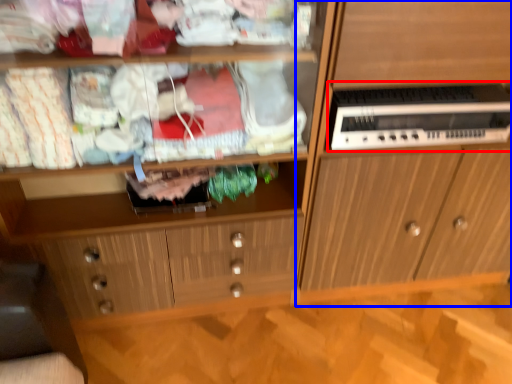
Question: Which point is further to the camera, home appliance (highlighted by a red box) or cabinetry (highlighted by a blue box)?

Choices:
 (A) home appliance
 (B) cabinetry

Answer: (A)